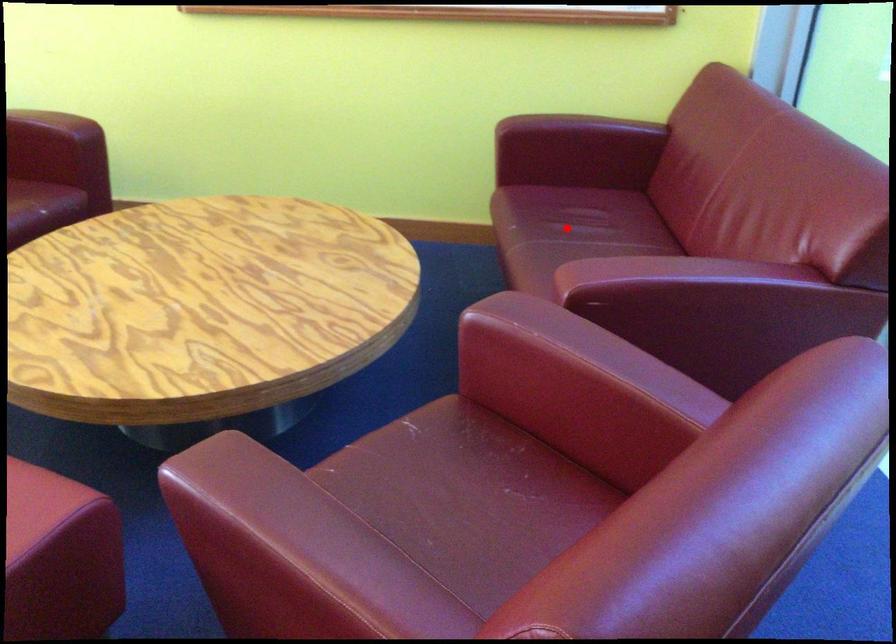
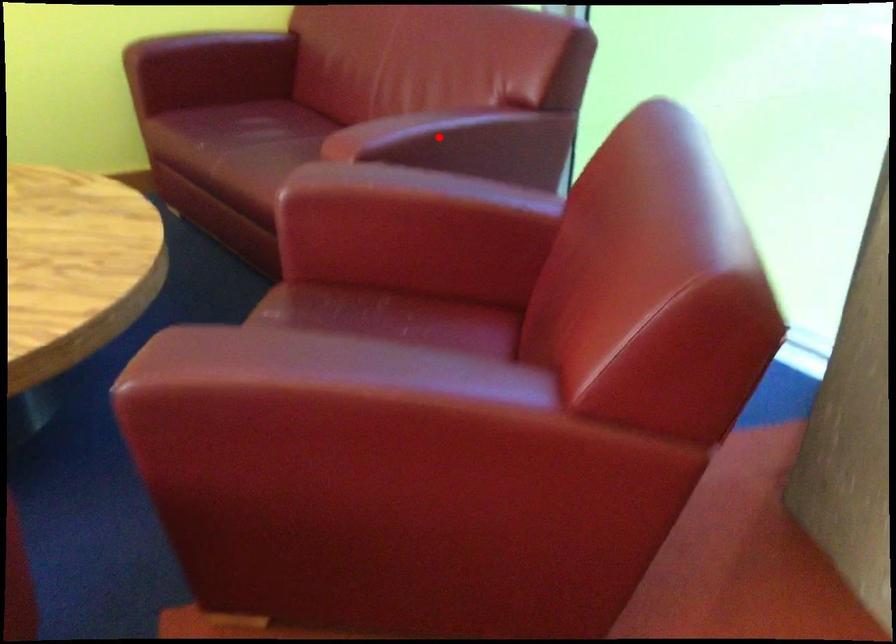
I am providing you with two images of the same scene from different viewpoints. A red point is marked on the first image and another point is marked on the second image. Do the highlighted points in image1 and image2 indicate the same real-world spot?

No